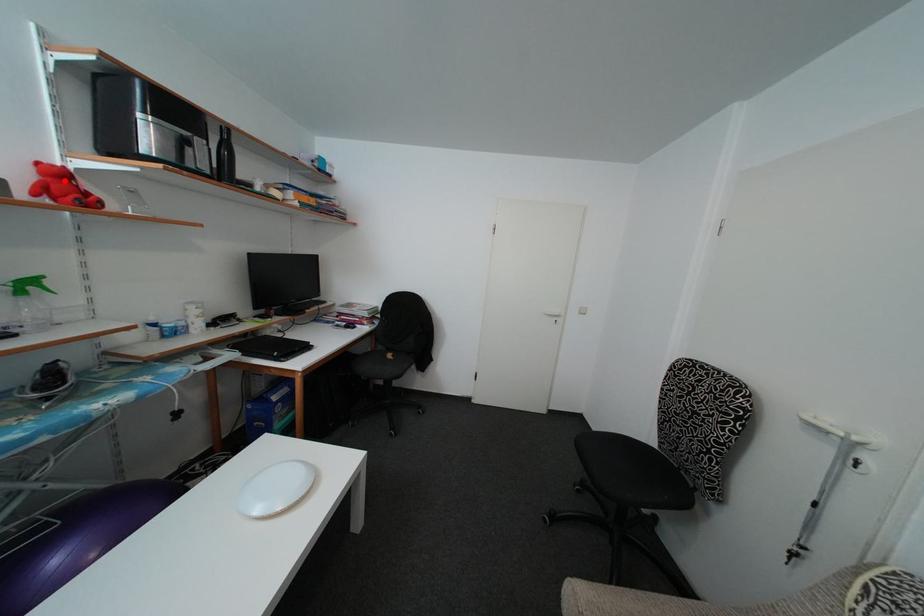
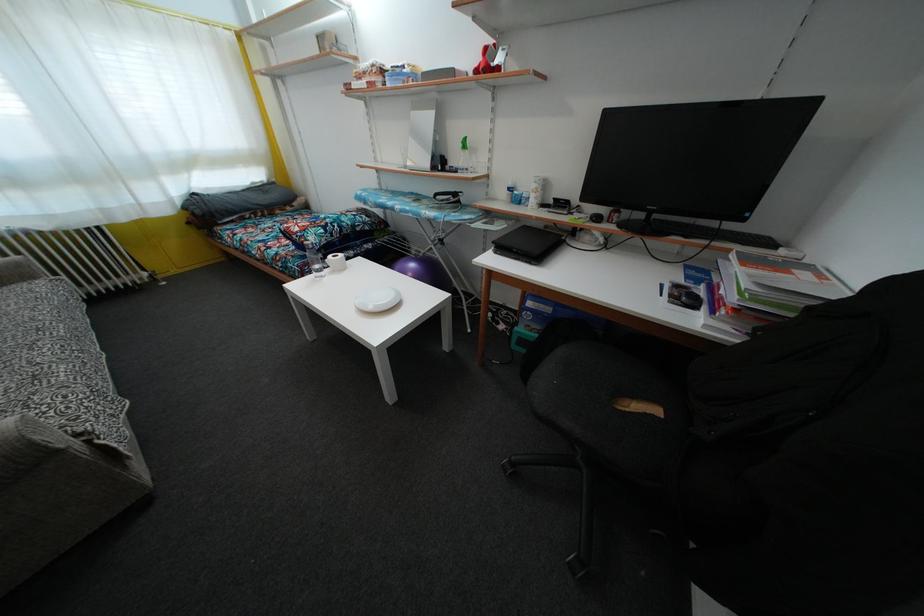
Question: I am providing you with two images of the same scene from different viewpoints. A red point is marked on the first image. Can you still see the location of the red point in image 2?

Choices:
 (A) Yes
 (B) No

Answer: (A)